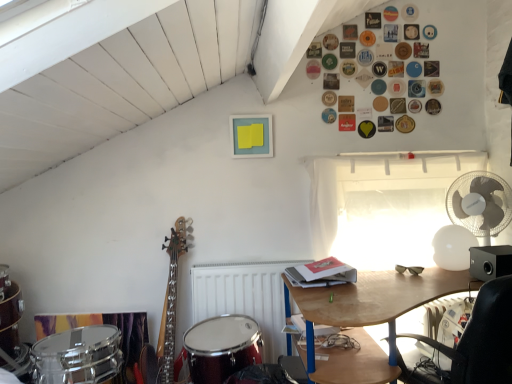
What is the approximate width of white matte radiator at lower center?

white matte radiator at lower center is 4.89 inches in width.

What do you see at coordinates (367, 318) in the screenshot? I see `wooden desk at lower right` at bounding box center [367, 318].

This screenshot has height=384, width=512. In order to click on white plastic fan at right in this screenshot , I will do `click(480, 204)`.

In order to face black plastic speaker at right, should I rotate leftwards or rightwards?

Rotate right and turn 29.884 degrees.

Where is `white sheer curtain at upper right`? white sheer curtain at upper right is located at coordinates (382, 207).

This screenshot has height=384, width=512. I want to click on white matte radiator at lower center, so click(x=244, y=297).

Is black leather chair at lower right closer to camera compared to white sheer curtain at upper right?

Yes, it is in front of white sheer curtain at upper right.

From a real-world perspective, between black leather chair at lower right and white sheer curtain at upper right, who is vertically lower?

black leather chair at lower right is physically lower.

Considering the relative sizes of black leather chair at lower right and white sheer curtain at upper right in the image provided, is black leather chair at lower right bigger than white sheer curtain at upper right?

Indeed, black leather chair at lower right has a larger size compared to white sheer curtain at upper right.

Considering the sizes of objects black leather chair at lower right and white sheer curtain at upper right in the image provided, who is shorter, black leather chair at lower right or white sheer curtain at upper right?

white sheer curtain at upper right.

Who is bigger, black plastic speaker at right or white sheer curtain at upper right?

white sheer curtain at upper right.

Based on their positions, is black plastic speaker at right located to the left or right of white sheer curtain at upper right?

In the image, black plastic speaker at right appears on the right side of white sheer curtain at upper right.

Is black plastic speaker at right aimed at white sheer curtain at upper right?

No, black plastic speaker at right is not oriented towards white sheer curtain at upper right.

Is matte black sunglasses at center right outside of white matte radiator at lower center?

That's correct, matte black sunglasses at center right is outside of white matte radiator at lower center.

Locate an element on the screen. The width and height of the screenshot is (512, 384). glasses located above the white matte radiator at lower center (from the image's perspective) is located at coordinates (409, 269).

From a real-world perspective, is matte black sunglasses at center right positioned above or below white matte radiator at lower center?

matte black sunglasses at center right is above white matte radiator at lower center.

Is matte black sunglasses at center right positioned with its back to white matte radiator at lower center?

No, matte black sunglasses at center right is not facing the opposite direction of white matte radiator at lower center.

Between white plastic fan at right and white sheer curtain at upper right, which one has larger width?

Wider between the two is white plastic fan at right.

Is point (489, 193) positioned in front of point (398, 204)?

Yes, point (489, 193) is closer to viewer.

The height and width of the screenshot is (384, 512). I want to click on window located below the white plastic fan at right (from the image's perspective), so click(x=382, y=207).

Considering the relative sizes of white plastic fan at right and white sheer curtain at upper right in the image provided, is white plastic fan at right smaller than white sheer curtain at upper right?

Indeed, white plastic fan at right has a smaller size compared to white sheer curtain at upper right.

Considering the positions of objects black plastic speaker at right and white plastic fan at right in the image provided, who is more to the left, black plastic speaker at right or white plastic fan at right?

black plastic speaker at right is more to the left.

Is black plastic speaker at right surrounding white plastic fan at right?

No.

How different are the orientations of black plastic speaker at right and white plastic fan at right in degrees?

33.2 degrees.

Is black plastic speaker at right closer to camera compared to white plastic fan at right?

That is True.

Is black leather chair at lower right taller than black plastic speaker at right?

Correct, black leather chair at lower right is much taller as black plastic speaker at right.

Considering the positions of objects black leather chair at lower right and black plastic speaker at right in the image provided, who is behind, black leather chair at lower right or black plastic speaker at right?

black plastic speaker at right is behind.

Is black plastic speaker at right a part of black leather chair at lower right?

No, black plastic speaker at right is not inside black leather chair at lower right.

Between black leather chair at lower right and black plastic speaker at right, which one appears on the left side from the viewer's perspective?

From the viewer's perspective, black leather chair at lower right appears more on the left side.

Could you tell me if white matte radiator at lower center is facing wooden desk at lower right?

No, white matte radiator at lower center is not turned towards wooden desk at lower right.

Is white matte radiator at lower center far away from wooden desk at lower right?

Actually, white matte radiator at lower center and wooden desk at lower right are a little close together.

From the picture: Which is more to the left, white matte radiator at lower center or wooden desk at lower right?

From the viewer's perspective, white matte radiator at lower center appears more on the left side.

Identify the location of chair below the white sheer curtain at upper right (from the image's perspective). (483, 338).

Find the location of a particular element. This screenshot has width=512, height=384. window above the black plastic speaker at right (from a real-world perspective) is located at coordinates (382, 207).

Consider the image. Which object lies further to the anchor point white matte radiator at lower center, shiny red drum at lower left or white plastic fan at right?

The object further to white matte radiator at lower center is white plastic fan at right.

When comparing their distances from shiny red drum at lower left, does black plastic speaker at right or wooden desk at lower right seem further?

black plastic speaker at right is positioned further to the anchor shiny red drum at lower left.

When comparing their distances from white matte radiator at lower center, does white sheer curtain at upper right or matte black sunglasses at center right seem further?

matte black sunglasses at center right lies further to white matte radiator at lower center than the other object.

Considering their positions, is shiny red drum at lower left positioned closer to wooden desk at lower right than black plastic speaker at right?

black plastic speaker at right is positioned closer to the anchor wooden desk at lower right.

When comparing their distances from white matte radiator at lower center, does wooden desk at lower right or white plastic fan at right seem closer?

wooden desk at lower right is closer to white matte radiator at lower center.

Based on their spatial positions, is white plastic fan at right or matte black sunglasses at center right closer to shiny red drum at lower left?

matte black sunglasses at center right lies closer to shiny red drum at lower left than the other object.

From the image, which object appears to be nearer to matte black sunglasses at center right, black plastic speaker at right or white sheer curtain at upper right?

black plastic speaker at right lies closer to matte black sunglasses at center right than the other object.

Looking at the image, which one is located further to white plastic fan at right, white matte radiator at lower center or wooden desk at lower right?

white matte radiator at lower center.

Find the location of `window between shiny red drum at lower left and black plastic speaker at right`. window between shiny red drum at lower left and black plastic speaker at right is located at coordinates (382, 207).

Find the location of a particular element. chair between white matte radiator at lower center and black plastic speaker at right is located at coordinates (483, 338).

Identify the location of chair between white matte radiator at lower center and white plastic fan at right in the horizontal direction. The width and height of the screenshot is (512, 384). (483, 338).

The image size is (512, 384). Identify the location of loudspeaker between black leather chair at lower right and matte black sunglasses at center right in the front-back direction. (490, 262).